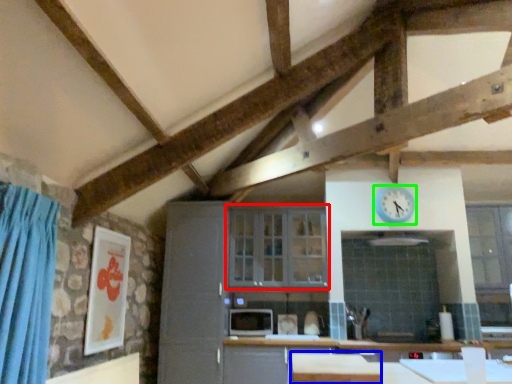
Question: Estimate the real-world distances between objects in this image. Which object is farther from window (highlighted by a red box), table (highlighted by a blue box) or clock (highlighted by a green box)?

Choices:
 (A) table
 (B) clock

Answer: (A)